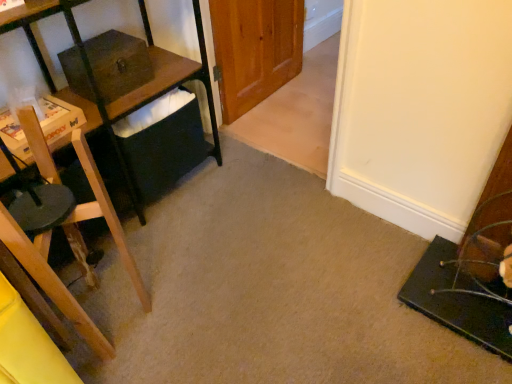
This screenshot has height=384, width=512. I want to click on vacant space in wooden chair at left (from a real-world perspective), so click(x=110, y=305).